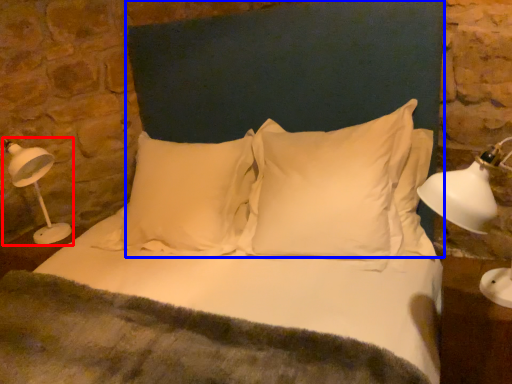
Question: Which object appears farthest to the camera in this image, table lamp (highlighted by a red box) or headboard (highlighted by a blue box)?

Choices:
 (A) table lamp
 (B) headboard

Answer: (A)